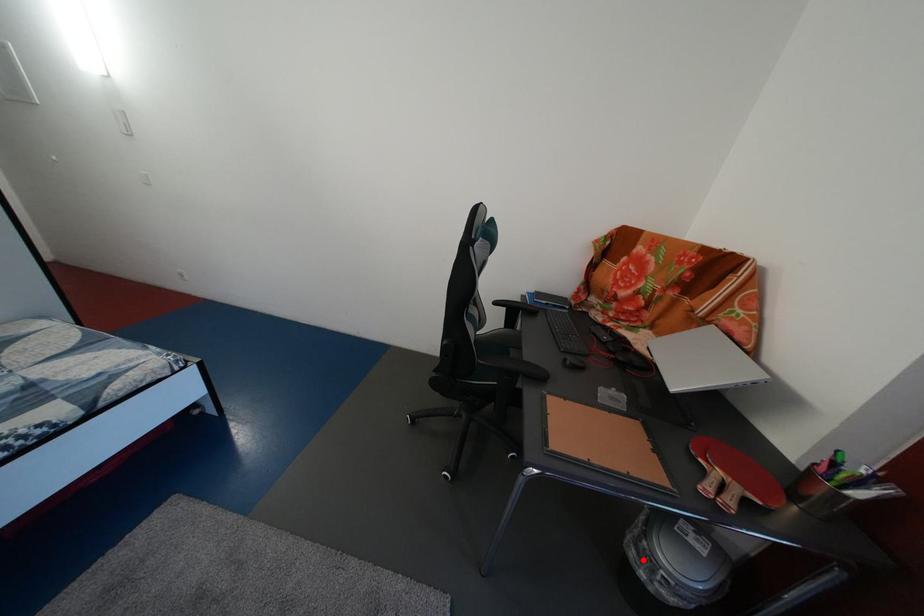
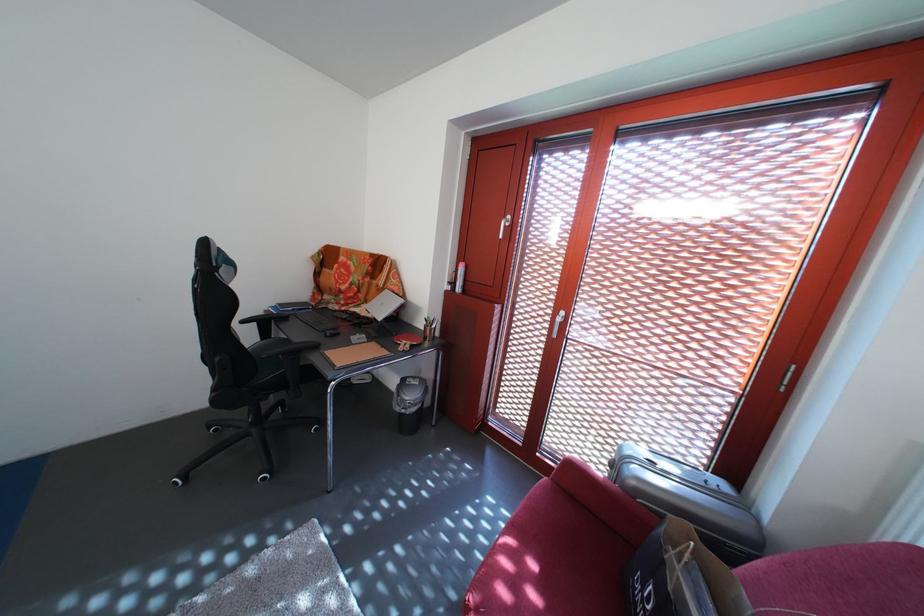
Locate, in the second image, the point that corresponds to the highlighted location in the first image.

(408, 416)